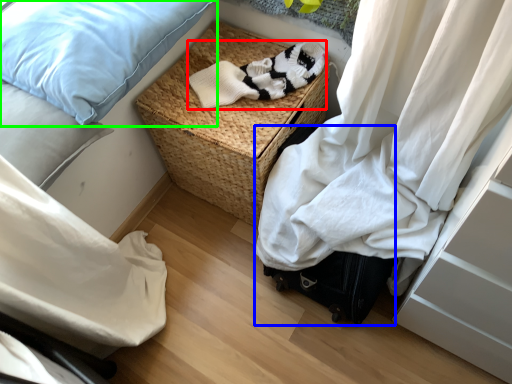
Question: Considering the real-world distances, which object is farthest from clothing (highlighted by a red box)? luggage (highlighted by a blue box) or pillow (highlighted by a green box)?

Choices:
 (A) luggage
 (B) pillow

Answer: (A)